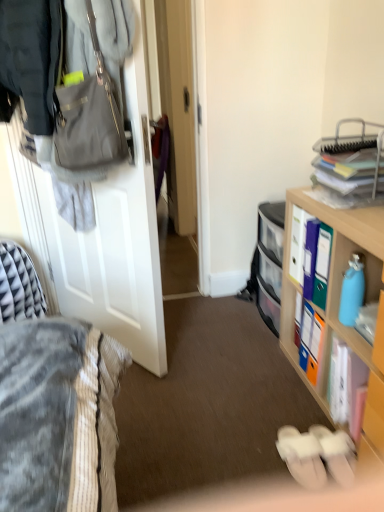
Where is `empty space that is in between white matte door at left and white fabric slippers at lower center, the first footwear from the left`? Image resolution: width=384 pixels, height=512 pixels. empty space that is in between white matte door at left and white fabric slippers at lower center, the first footwear from the left is located at coordinates (211, 411).